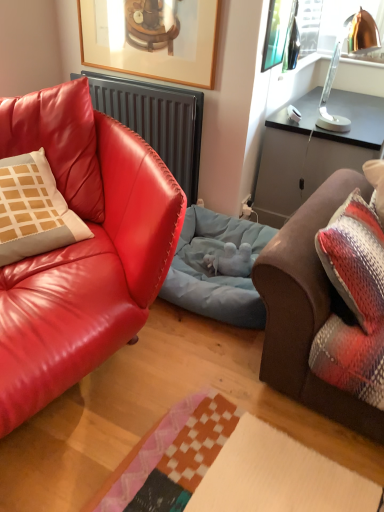
Question: Is brown leather couch at right, the 2th studio couch from the left, aimed at light blue fabric dog bed at center?

Choices:
 (A) no
 (B) yes

Answer: (A)

Question: Is brown leather couch at right, which appears as the first studio couch when viewed from the right, not near light blue fabric dog bed at center?

Choices:
 (A) no
 (B) yes

Answer: (A)

Question: Does brown leather couch at right, which appears as the first studio couch when viewed from the right, have a larger size compared to light blue fabric dog bed at center?

Choices:
 (A) no
 (B) yes

Answer: (B)

Question: Is brown leather couch at right, the 2th studio couch from the left, positioned before light blue fabric dog bed at center?

Choices:
 (A) yes
 (B) no

Answer: (A)

Question: Can you confirm if brown leather couch at right, which appears as the first studio couch when viewed from the right, is shorter than light blue fabric dog bed at center?

Choices:
 (A) no
 (B) yes

Answer: (A)

Question: Is copper metallic lamp at upper right inside or outside of wooden framed picture at upper center?

Choices:
 (A) outside
 (B) inside

Answer: (A)

Question: Is copper metallic lamp at upper right wider or thinner than wooden framed picture at upper center?

Choices:
 (A) wide
 (B) thin

Answer: (A)

Question: Is copper metallic lamp at upper right in front of or behind wooden framed picture at upper center in the image?

Choices:
 (A) front
 (B) behind

Answer: (A)

Question: Is point (369, 26) closer or farther from the camera than point (102, 31)?

Choices:
 (A) closer
 (B) farther

Answer: (A)

Question: Looking at their shapes, would you say matte red leather couch at left, marked as the 2th studio couch in a right-to-left arrangement, is wider or thinner than wooden framed picture at upper center?

Choices:
 (A) wide
 (B) thin

Answer: (A)

Question: From the image's perspective, relative to wooden framed picture at upper center, is matte red leather couch at left, marked as the 2th studio couch in a right-to-left arrangement, above or below?

Choices:
 (A) above
 (B) below

Answer: (B)

Question: From a real-world perspective, relative to wooden framed picture at upper center, is matte red leather couch at left, the first studio couch from the left, vertically above or below?

Choices:
 (A) above
 (B) below

Answer: (B)

Question: Is matte red leather couch at left, the first studio couch from the left, in front of or behind wooden framed picture at upper center in the image?

Choices:
 (A) front
 (B) behind

Answer: (A)

Question: Would you say wooden framed picture at upper center is to the left or to the right of brown leather couch at right, which appears as the first studio couch when viewed from the right, in the picture?

Choices:
 (A) right
 (B) left

Answer: (B)

Question: Is wooden framed picture at upper center in front of or behind brown leather couch at right, which appears as the first studio couch when viewed from the right, in the image?

Choices:
 (A) front
 (B) behind

Answer: (B)